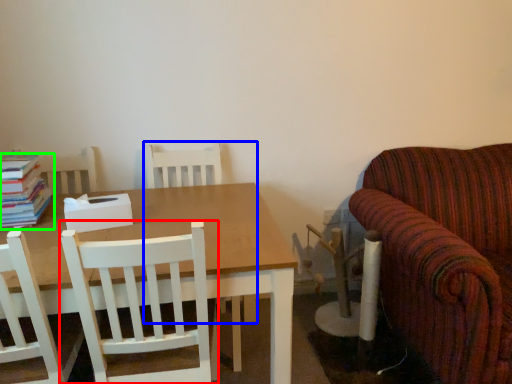
Question: Which object is the closest to the chair (highlighted by a red box)? Choose among these: chair (highlighted by a blue box) or book (highlighted by a green box).

Choices:
 (A) chair
 (B) book

Answer: (B)